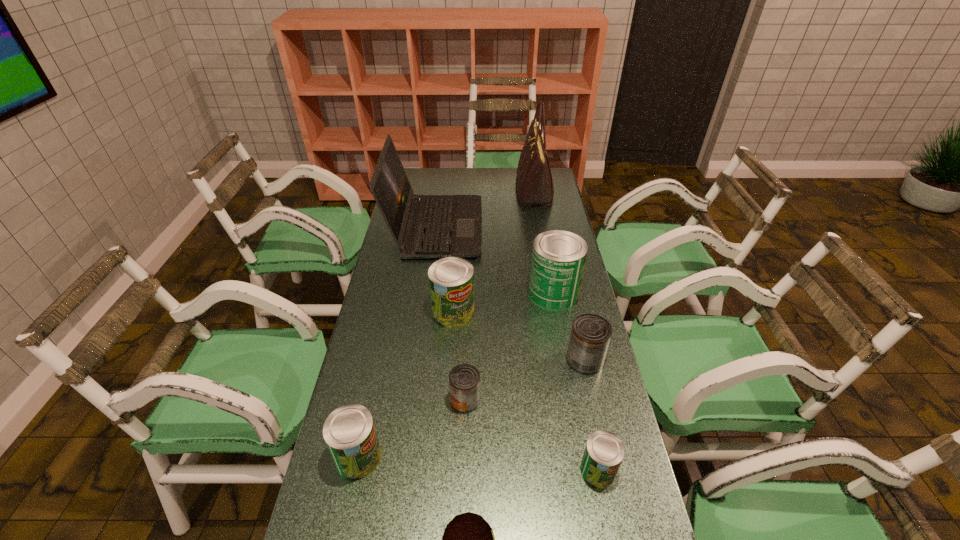
Where is `free space at the left edge of the desktop`? This screenshot has height=540, width=960. free space at the left edge of the desktop is located at coordinates (414, 323).

Find the location of a particular element. This screenshot has height=540, width=960. vacant area that lies between the smallest green can and the handbag is located at coordinates (566, 330).

Locate an element on the screen. empty space that is in between the right red can and the nearer red can is located at coordinates (x=525, y=380).

Where is `vacant area that lies between the second green can from left to right and the bigger red can`? vacant area that lies between the second green can from left to right and the bigger red can is located at coordinates (518, 336).

This screenshot has height=540, width=960. Identify the location of vacant area that lies between the leftmost green can and the second biggest green can. (406, 384).

Where is `object that ranks as the second closest to the patty`? Image resolution: width=960 pixels, height=540 pixels. object that ranks as the second closest to the patty is located at coordinates (604, 451).

Select which object appears as the eighth closest to the tallest object. Please provide its 2D coordinates. Your answer should be formatted as a tuple, i.e. [(x, y)], where the tuple contains the x and y coordinates of a point satisfying the conditions above.

[(468, 539)]

Where is `the fourth closest can relative to the smallest green can`? This screenshot has width=960, height=540. the fourth closest can relative to the smallest green can is located at coordinates (558, 259).

Identify which can is located as the third nearest to the farther red can. Please provide its 2D coordinates. Your answer should be formatted as a tuple, i.e. [(x, y)], where the tuple contains the x and y coordinates of a point satisfying the conditions above.

[(464, 379)]

Point out which green can is positioned as the third nearest to the laptop_computer. Please provide its 2D coordinates. Your answer should be formatted as a tuple, i.e. [(x, y)], where the tuple contains the x and y coordinates of a point satisfying the conditions above.

[(349, 432)]